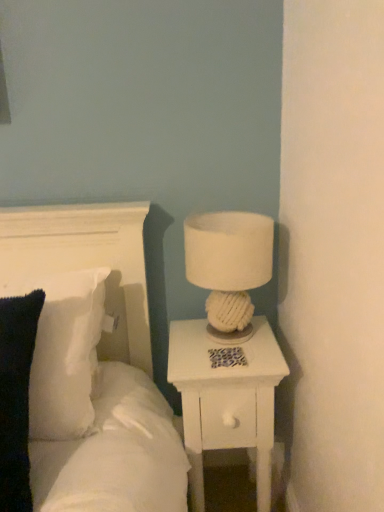
Question: Can you confirm if white soft pillow at upper left is smaller than white soft pillow at left?

Choices:
 (A) no
 (B) yes

Answer: (A)

Question: Does white soft pillow at upper left lie in front of white soft pillow at left?

Choices:
 (A) yes
 (B) no

Answer: (A)

Question: Considering the relative sizes of white soft pillow at upper left and white soft pillow at left in the image provided, is white soft pillow at upper left shorter than white soft pillow at left?

Choices:
 (A) yes
 (B) no

Answer: (B)

Question: From a real-world perspective, is white soft pillow at upper left physically above white soft pillow at left?

Choices:
 (A) no
 (B) yes

Answer: (B)

Question: Would you say white soft pillow at upper left contains white soft pillow at left?

Choices:
 (A) no
 (B) yes

Answer: (B)

Question: Based on their sizes in the image, would you say white soft pillow at left is bigger or smaller than white wood nightstand at right?

Choices:
 (A) small
 (B) big

Answer: (A)

Question: Is white soft pillow at left in front of or behind white wood nightstand at right in the image?

Choices:
 (A) front
 (B) behind

Answer: (A)

Question: Looking at their shapes, would you say white soft pillow at left is wider or thinner than white wood nightstand at right?

Choices:
 (A) wide
 (B) thin

Answer: (B)

Question: Considering the positions of point (49, 349) and point (258, 357), is point (49, 349) closer or farther from the camera than point (258, 357)?

Choices:
 (A) closer
 (B) farther

Answer: (A)

Question: Considering the positions of white soft pillow at upper left and white fabric lampshade at upper right in the image, is white soft pillow at upper left taller or shorter than white fabric lampshade at upper right?

Choices:
 (A) short
 (B) tall

Answer: (B)

Question: From the image's perspective, is white soft pillow at upper left above or below white fabric lampshade at upper right?

Choices:
 (A) above
 (B) below

Answer: (B)

Question: Considering their positions, is white soft pillow at upper left located in front of or behind white fabric lampshade at upper right?

Choices:
 (A) behind
 (B) front

Answer: (B)

Question: Is point (74, 241) closer or farther from the camera than point (225, 285)?

Choices:
 (A) farther
 (B) closer

Answer: (A)

Question: Is white soft pillow at upper left inside the boundaries of white soft pillow at left, or outside?

Choices:
 (A) inside
 (B) outside

Answer: (A)

Question: Is point (117, 459) closer or farther from the camera than point (46, 293)?

Choices:
 (A) farther
 (B) closer

Answer: (B)